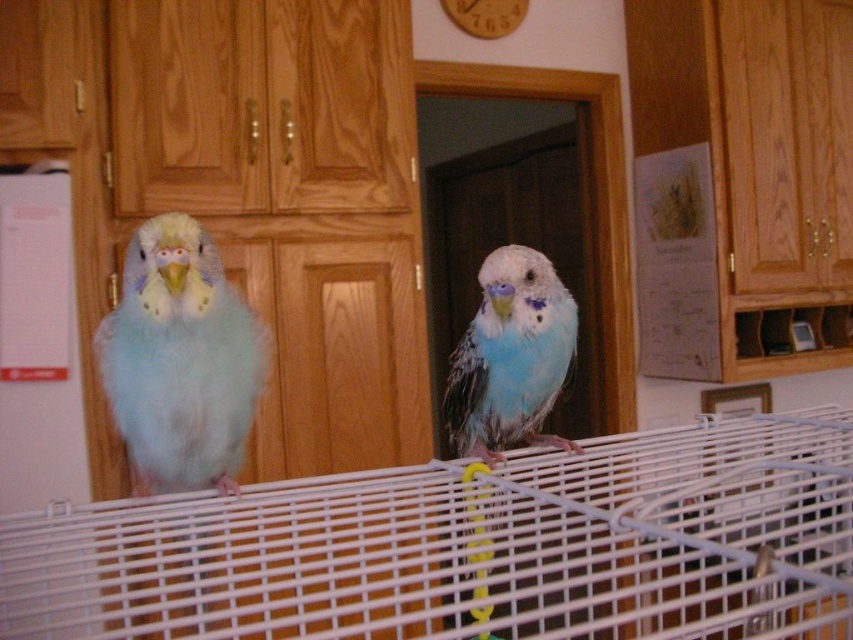
Can you confirm if light blue feathered parrot at left is positioned to the left of light blue feathered parrot at center?

Yes, light blue feathered parrot at left is to the left of light blue feathered parrot at center.

Is point (193, 339) behind point (534, 332)?

No.

Identify the location of light blue feathered parrot at left. (180, 358).

Is white wire cage at center positioned before light blue feathered parrot at left?

Yes, white wire cage at center is in front of light blue feathered parrot at left.

Who is positioned more to the left, white wire cage at center or light blue feathered parrot at left?

From the viewer's perspective, light blue feathered parrot at left appears more on the left side.

Find the location of a particular element. The height and width of the screenshot is (640, 853). white wire cage at center is located at coordinates coord(469,547).

Consider the image. Is white wire cage at center thinner than light blue feathered parrot at center?

Incorrect, white wire cage at center's width is not less than light blue feathered parrot at center's.

Locate an element on the screen. The image size is (853, 640). white wire cage at center is located at coordinates (469, 547).

Is point (317, 477) positioned before point (459, 388)?

That is True.

In order to click on white wire cage at center in this screenshot , I will do `click(469, 547)`.